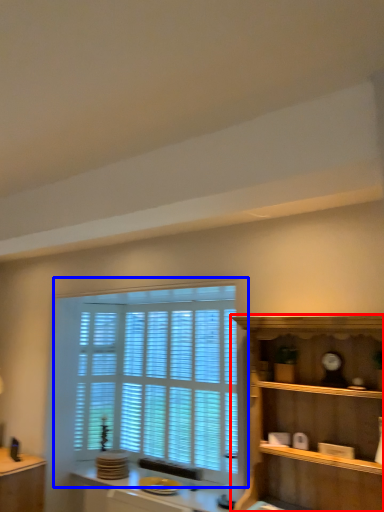
Question: Which object appears farthest to the camera in this image, shelf (highlighted by a red box) or window (highlighted by a blue box)?

Choices:
 (A) shelf
 (B) window

Answer: (B)